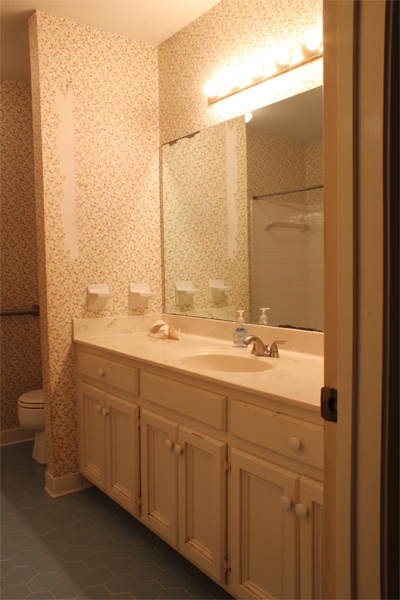
Identify the location of countertop. Image resolution: width=400 pixels, height=600 pixels. (153, 350), (287, 379).